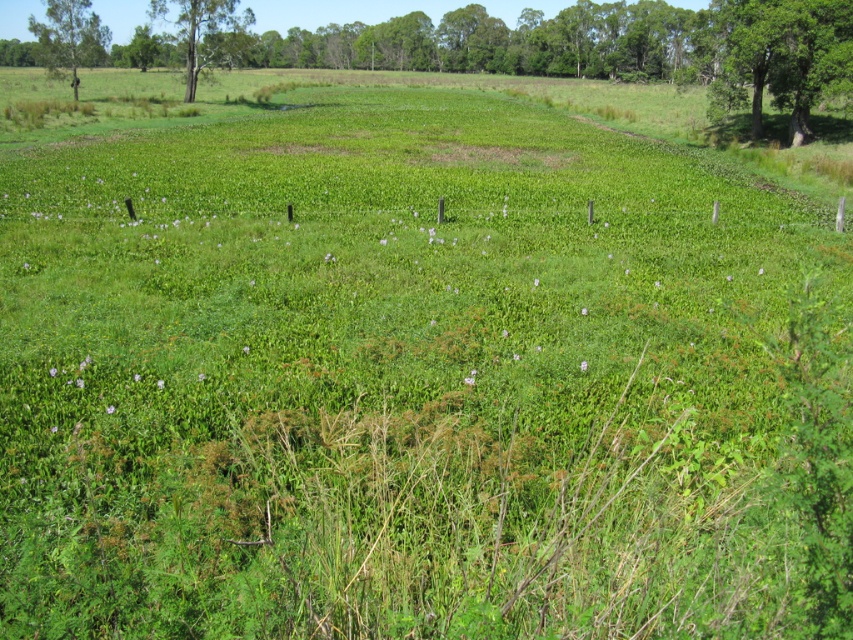
Can you confirm if green leafy tree at upper right is wider than green leafy tree at upper left?

In fact, green leafy tree at upper right might be narrower than green leafy tree at upper left.

Is point (814, 8) less distant than point (55, 1)?

That is True.

The image size is (853, 640). I want to click on green leafy tree at upper right, so click(780, 58).

What do you see at coordinates (206, 33) in the screenshot? The width and height of the screenshot is (853, 640). I see `smooth bark tree at upper left` at bounding box center [206, 33].

Can you confirm if smooth bark tree at upper left is thinner than green leafy tree at upper left?

Yes.

You are a GUI agent. You are given a task and a screenshot of the screen. Output one action in this format:
    pyautogui.click(x=<x>, y=<y>)
    Task: Click on the smooth bark tree at upper left
    This screenshot has width=853, height=640.
    Given the screenshot: What is the action you would take?
    pyautogui.click(x=206, y=33)

Identify the location of smooth bark tree at upper left. (206, 33).

Can you confirm if green leafy tree at upper right is wider than smooth bark tree at upper left?

No, green leafy tree at upper right is not wider than smooth bark tree at upper left.

Does point (730, 22) lie in front of point (223, 1)?

Yes, point (730, 22) is closer to viewer.

Is point (795, 84) in front of point (183, 40)?

Yes.

You are a GUI agent. You are given a task and a screenshot of the screen. Output one action in this format:
    pyautogui.click(x=<x>, y=<y>)
    Task: Click on the green leafy tree at upper right
    Image resolution: width=853 pixels, height=640 pixels.
    Given the screenshot: What is the action you would take?
    pyautogui.click(x=780, y=58)